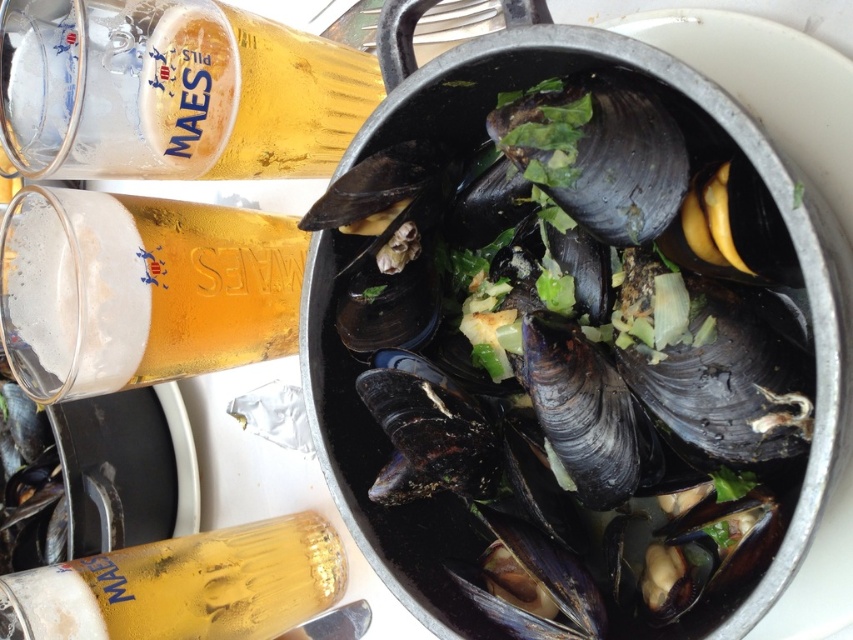
Question: Can you confirm if glossy dark shellfish at center is wider than foamy golden beer at upper left?

Choices:
 (A) yes
 (B) no

Answer: (A)

Question: Based on their relative distances, which object is farther from the foamy golden beer at upper left?

Choices:
 (A) glossy dark shellfish at center
 (B) translucent glass beer at upper left

Answer: (A)

Question: In this image, where is translucent glass beer at upper left located relative to translucent glass bottle at lower left?

Choices:
 (A) below
 (B) above

Answer: (B)

Question: Which object is farther from the camera taking this photo?

Choices:
 (A) foamy golden beer at upper left
 (B) glossy dark shellfish at center
 (C) translucent glass bottle at lower left
 (D) translucent glass beer at upper left

Answer: (C)

Question: Is glossy dark shellfish at center smaller than foamy golden beer at upper left?

Choices:
 (A) no
 (B) yes

Answer: (A)

Question: Which point is closer to the camera taking this photo?

Choices:
 (A) (120, 339)
 (B) (380, 448)

Answer: (A)